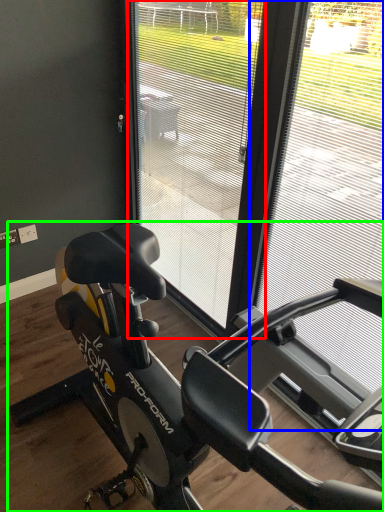
Question: Estimate the real-world distances between objects in this image. Which object is closer to screen door (highlighted by a red box), window frame (highlighted by a blue box) or stationary bicycle (highlighted by a green box)?

Choices:
 (A) window frame
 (B) stationary bicycle

Answer: (A)